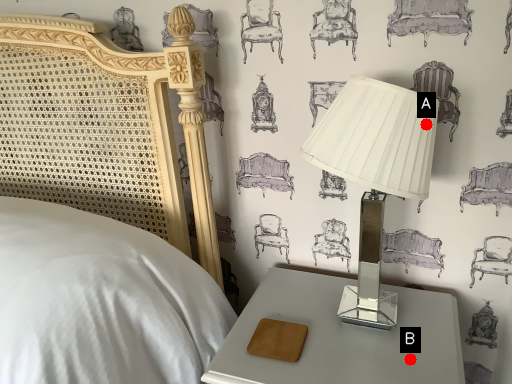
Question: Two points are circled on the image, labeled by A and B beside each circle. Among these points, which one is farthest from the camera?

Choices:
 (A) A is further
 (B) B is further

Answer: (B)